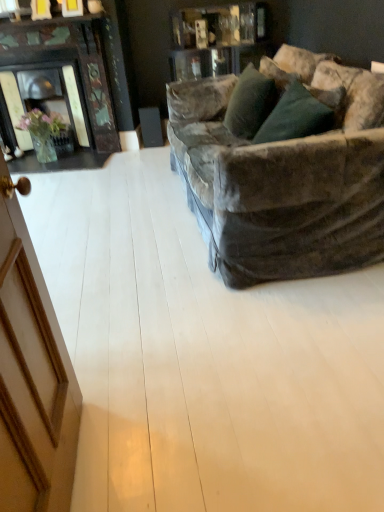
Image resolution: width=384 pixels, height=512 pixels. Identify the location of vacant space situated above light wood floor at center (from a real-world perspective). (113, 251).